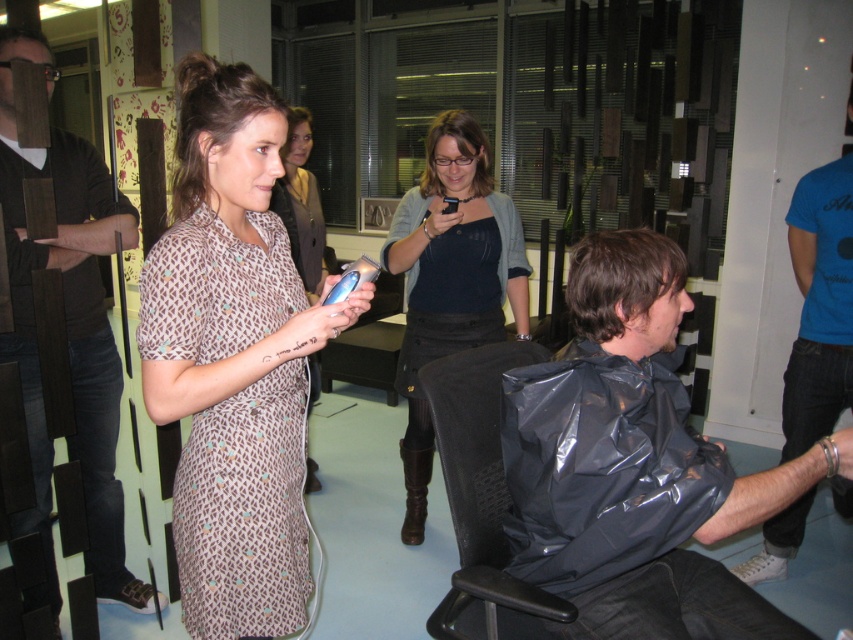
Does dark brown leather jacket at upper left have a greater width compared to dark blue jersey at center?

Incorrect, dark brown leather jacket at upper left's width does not surpass dark blue jersey at center's.

Describe the element at coordinates (68, 333) in the screenshot. I see `dark brown leather jacket at upper left` at that location.

The width and height of the screenshot is (853, 640). Find the location of `dark brown leather jacket at upper left`. dark brown leather jacket at upper left is located at coordinates (68, 333).

Who is higher up, matte black shirt at center or blue cotton t-shirt at right?

matte black shirt at center is higher up.

Between point (461, 184) and point (819, 406), which one is positioned in front?

Point (461, 184) is more forward.

Locate an element on the screen. The height and width of the screenshot is (640, 853). matte black shirt at center is located at coordinates (450, 278).

Can you confirm if dark brown leather jacket at upper left is positioned above patterned fabric dress at center?

Incorrect, dark brown leather jacket at upper left is not positioned above patterned fabric dress at center.

Is point (9, 266) positioned after point (309, 145)?

No.

Who is more forward, (32, 291) or (314, 237)?

Point (32, 291)

What are the coordinates of `dark brown leather jacket at upper left` in the screenshot? It's located at (x=68, y=333).